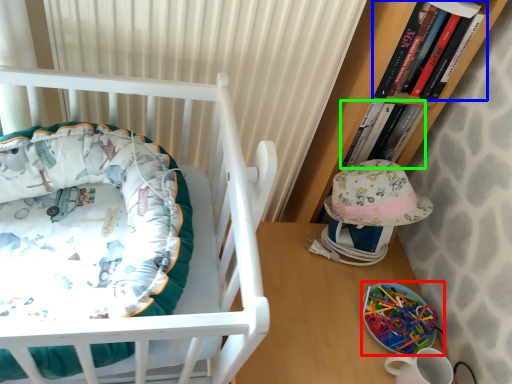
Question: Which object is positioned closest to equipment (highlighted by a red box)? Select from book (highlighted by a blue box) and book (highlighted by a green box).

Choices:
 (A) book
 (B) book

Answer: (B)